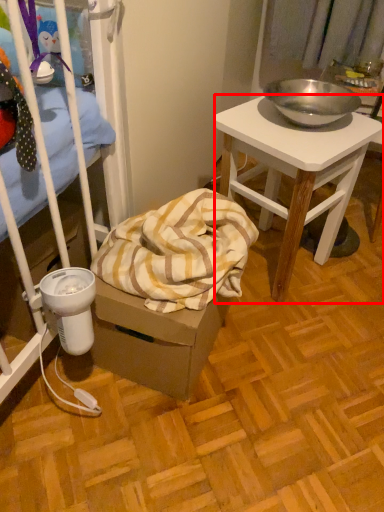
Question: From the image's perspective, where is desk (annotated by the red box) located relative to blanket?

Choices:
 (A) above
 (B) below

Answer: (A)